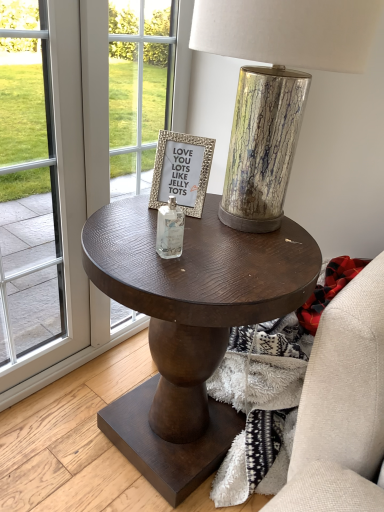
What are the coordinates of `free spot in front of clear glass bottle at center` in the screenshot? It's located at (166, 276).